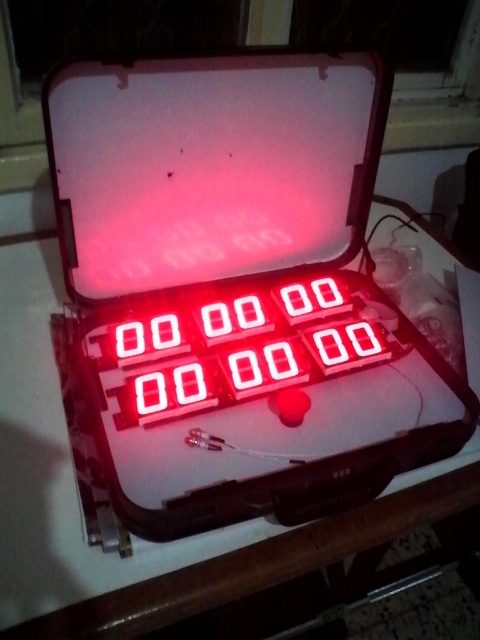
You are standing in front of a red plastic case with an open interior. You notice a white plastic case at center and a red led display at center. Which object is positioned to the right side?

The red led display at center is positioned to the right of the white plastic case at center.

You are standing in front of a white plastic case at center. If you want to reach it without moving your feet, is it within your arm reach?

The white plastic case at center is 23.21 inches away from you. Since the average human arm length is about 25 inches, you can just barely reach it without moving your feet.